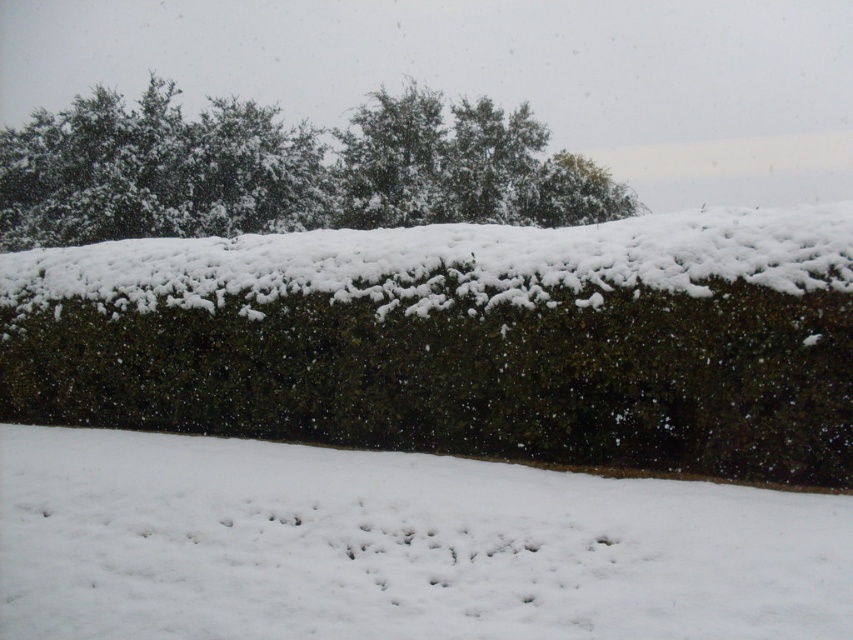
You are an observer standing in front of the snow scene. You notice the white fluffy snow at lower center and the green leafy tree at upper center. Which of these two objects has a smaller width?

The white fluffy snow at lower center has a lesser width compared to the green leafy tree at upper center.

You are standing in the winter scene and want to take a photo of both the white fluffy snow at lower center and the green leafy tree at upper center. Since the snow is closer to you, will it appear larger in the photo compared to the tree?

Yes, the white fluffy snow at lower center will appear larger in the photo than the green leafy tree at upper center because it is closer to the viewer.

Based on the scene, which object is taller between the green leafy hedge at center and the green leafy tree at upper center?

The green leafy tree at upper center is taller than the green leafy hedge at center.